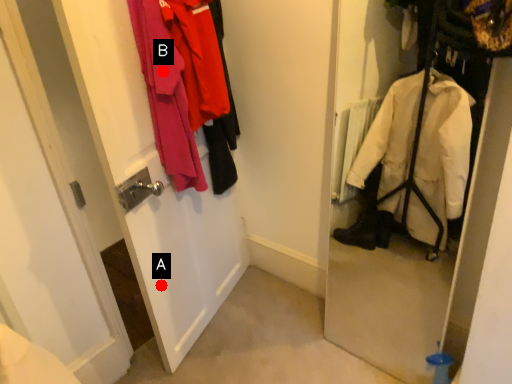
Question: Two points are circled on the image, labeled by A and B beside each circle. Which of the following is the closest to the observer?

Choices:
 (A) A is closer
 (B) B is closer

Answer: (B)